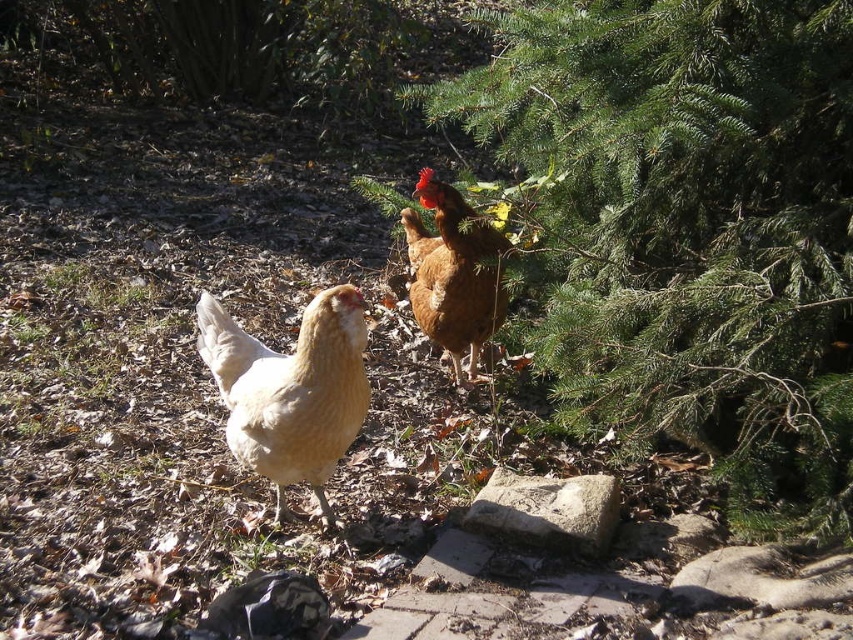
Does green needle-like leaves at upper right lie behind brown matte chicken at upper center?

No, it is in front of brown matte chicken at upper center.

Which is behind, point (691, 332) or point (432, 204)?

The point (432, 204) is behind.

Find the location of a particular element. Image resolution: width=853 pixels, height=640 pixels. green needle-like leaves at upper right is located at coordinates (691, 227).

The width and height of the screenshot is (853, 640). Identify the location of green needle-like leaves at upper right. (691, 227).

Does green needle-like leaves at upper right have a greater height compared to light brown feathered chicken at center?

Yes, green needle-like leaves at upper right is taller than light brown feathered chicken at center.

Which is in front, point (795, 513) or point (260, 396)?

Positioned in front is point (260, 396).

The image size is (853, 640). Find the location of `green needle-like leaves at upper right`. green needle-like leaves at upper right is located at coordinates (691, 227).

Which is in front, point (241, 385) or point (485, 332)?

Point (241, 385) is in front.

The height and width of the screenshot is (640, 853). What do you see at coordinates (291, 390) in the screenshot?
I see `light brown feathered chicken at center` at bounding box center [291, 390].

Which is in front, point (216, 300) or point (468, 205)?

Point (468, 205) is in front.

You are a GUI agent. You are given a task and a screenshot of the screen. Output one action in this format:
    pyautogui.click(x=<x>, y=<y>)
    Task: Click on the light brown feathered chicken at center
    This screenshot has height=640, width=853.
    Given the screenshot: What is the action you would take?
    [x=291, y=390]